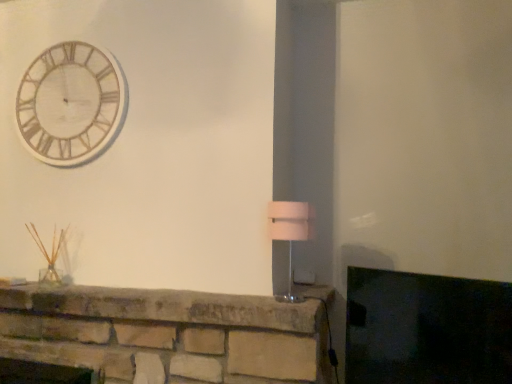
Question: Is wooden/textured clock at upper left thinner than matte stone fireplace at lower left?

Choices:
 (A) yes
 (B) no

Answer: (A)

Question: Considering the relative sizes of wooden/textured clock at upper left and matte stone fireplace at lower left in the image provided, is wooden/textured clock at upper left smaller than matte stone fireplace at lower left?

Choices:
 (A) no
 (B) yes

Answer: (B)

Question: Is wooden/textured clock at upper left taller than matte stone fireplace at lower left?

Choices:
 (A) yes
 (B) no

Answer: (A)

Question: Does wooden/textured clock at upper left have a greater width compared to matte stone fireplace at lower left?

Choices:
 (A) no
 (B) yes

Answer: (A)

Question: Would you say wooden/textured clock at upper left contains matte stone fireplace at lower left?

Choices:
 (A) yes
 (B) no

Answer: (B)

Question: Does wooden/textured clock at upper left have a lesser height compared to matte stone fireplace at lower left?

Choices:
 (A) no
 (B) yes

Answer: (A)

Question: Does wooden/textured clock at upper left have a smaller size compared to white fabric lampshade at right?

Choices:
 (A) yes
 (B) no

Answer: (B)

Question: Does wooden/textured clock at upper left have a greater width compared to white fabric lampshade at right?

Choices:
 (A) no
 (B) yes

Answer: (A)

Question: Is wooden/textured clock at upper left shorter than white fabric lampshade at right?

Choices:
 (A) yes
 (B) no

Answer: (B)

Question: From a real-world perspective, is wooden/textured clock at upper left physically below white fabric lampshade at right?

Choices:
 (A) yes
 (B) no

Answer: (B)

Question: Is the depth of wooden/textured clock at upper left less than that of white fabric lampshade at right?

Choices:
 (A) yes
 (B) no

Answer: (B)

Question: Does wooden/textured clock at upper left appear on the left side of white fabric lampshade at right?

Choices:
 (A) yes
 (B) no

Answer: (A)

Question: Can you confirm if matte stone fireplace at lower left is positioned to the left of wooden/textured clock at upper left?

Choices:
 (A) yes
 (B) no

Answer: (B)